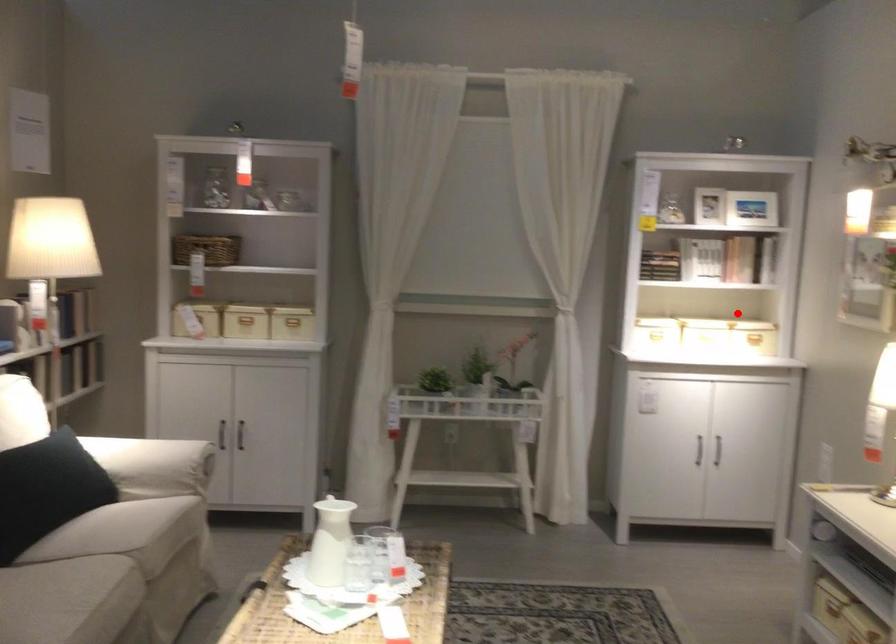
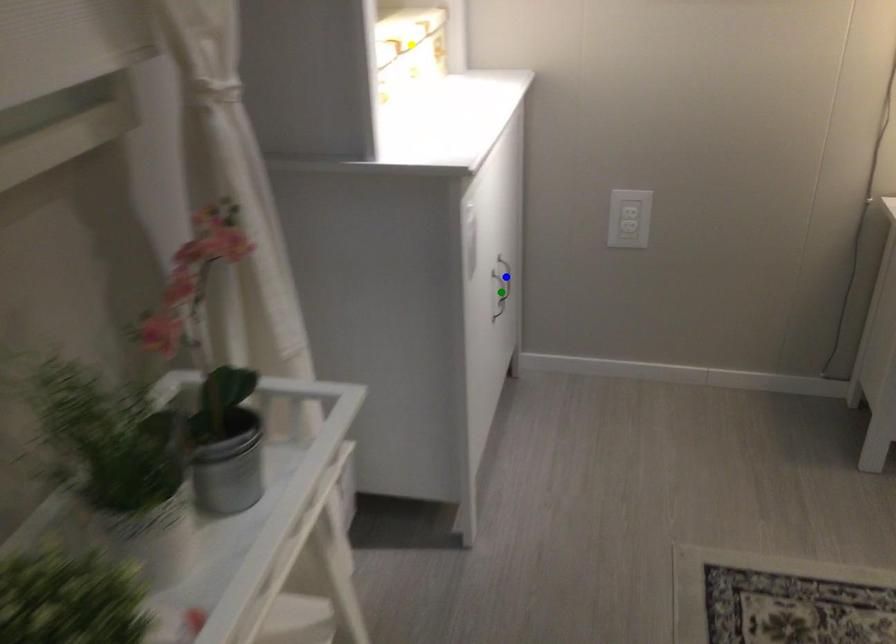
Question: I am providing you with two images of the same scene from different viewpoints. A red point is marked on the first image. You are given multiple points on the second image. Can you choose the point in image 2 that corresponds to the point in image 1?

Choices:
 (A) yellow point
 (B) green point
 (C) blue point

Answer: (A)